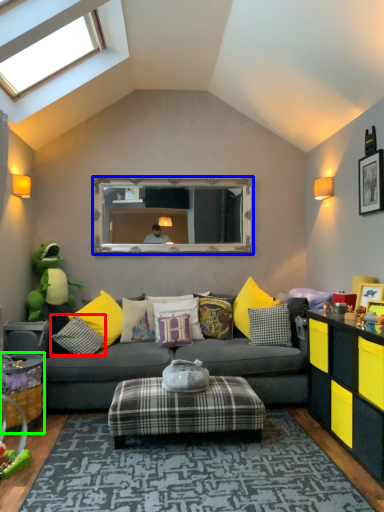
Question: Which object is the farthest from pillow (highlighted by a red box)? Choose among these: mirror (highlighted by a blue box) or table (highlighted by a green box).

Choices:
 (A) mirror
 (B) table

Answer: (A)